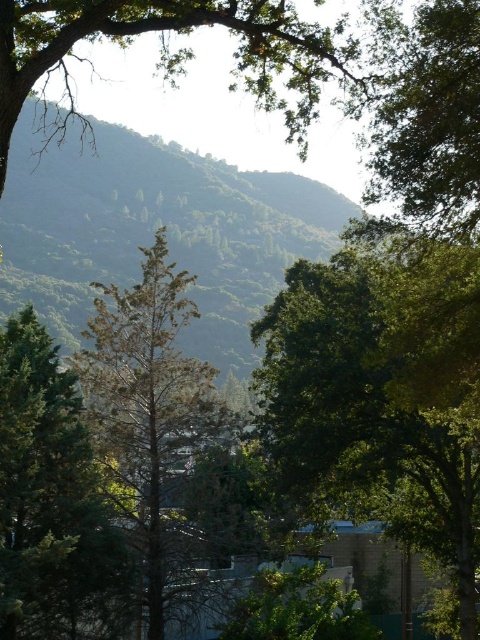
Looking at this image, you are a hiker carrying a 4 meter long ladder. You need to place it between the green leafy tree at center and the green leafy tree at upper right. Will the ladder fit between them?

The green leafy tree at center and green leafy tree at upper right are 4.35 meters apart, so the 4 meter long ladder will fit between them since the distance is greater than the ladder length.